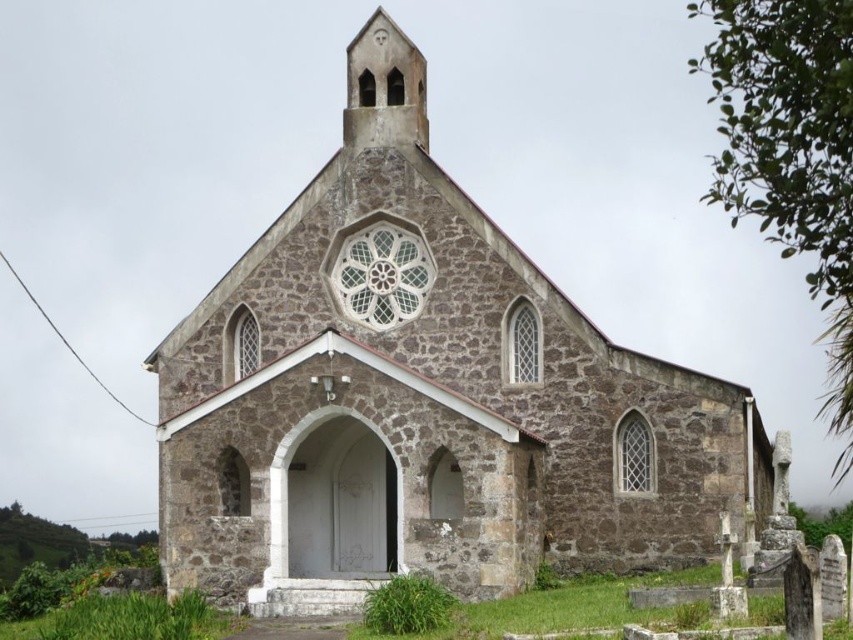
Looking at this image, you are a photographer standing at a certain distance from the brown stone church at center. You want to capture the entire church in one frame without moving your camera. What is the minimum focal length lens you should use if your camera sensor has a diagonal measurement of 24mm and the church occupies 80 percent of the frame?

The minimum focal length lens required is approximately 24mm multiplied by the ratio of the sensor diagonal to the subject distance. Since the brown stone church at center is 66.56 meters away, the calculation would be 24mm x 0.8 divided by 66.56 meters, resulting in approximately 0.288mm. However, this result is unrealistic, indicating an error in the approach. A correct method would involve using the formula focal length equals sensor size divided by the ratio of the subject size to the distance. Without

You are standing in the middle of a field looking at the brown stone church at center and the smooth stone spire at upper center. Which object is positioned higher in the image?

The smooth stone spire at upper center is positioned higher than the brown stone church at center in the image.

You are a drone operator tasked with capturing aerial footage of the brown stone church at center and the smooth stone spire at upper center. Your drone has a maximum flight range of 20 meters. Can the drone safely capture footage of both structures without exceeding its range?

The distance between the brown stone church at center and the smooth stone spire at upper center is 19.95 meters, which is just under the drone operator drone has a maximum flight range of 20 meters. Therefore, the drone can safely capture footage of both structures without exceeding its range.